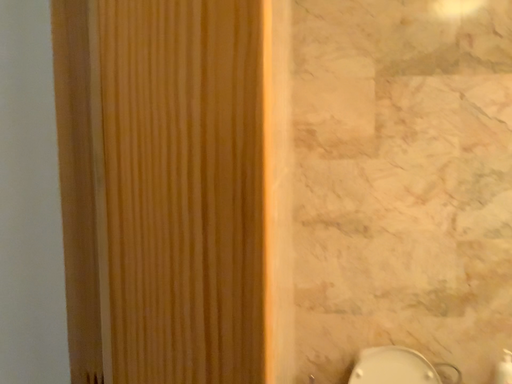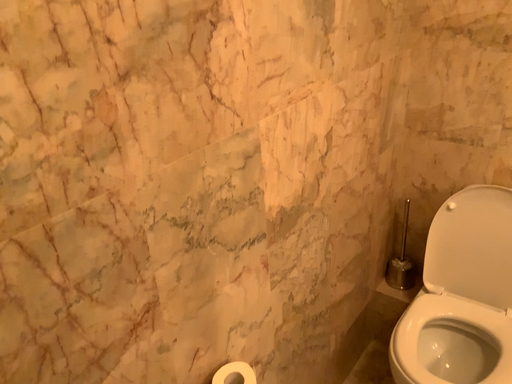
Question: Which way did the camera rotate in the video?

Choices:
 (A) rotated right
 (B) rotated left

Answer: (B)